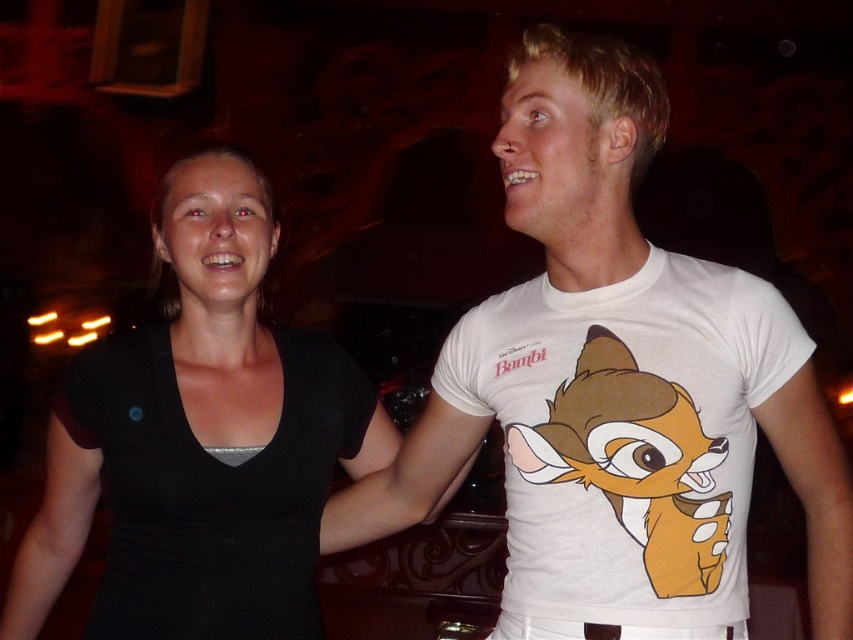
Question: Can you confirm if white cotton t-shirt at upper right is smaller than white cotton t-shirt at right?

Choices:
 (A) no
 (B) yes

Answer: (A)

Question: Considering the relative positions of white cotton t-shirt at upper right and white cotton t-shirt at right in the image provided, where is white cotton t-shirt at upper right located with respect to white cotton t-shirt at right?

Choices:
 (A) right
 (B) left

Answer: (B)

Question: Which object appears closest to the camera in this image?

Choices:
 (A) white cotton t-shirt at right
 (B) white cotton t-shirt at upper right

Answer: (A)

Question: Which object appears farthest from the camera in this image?

Choices:
 (A) white cotton t-shirt at upper right
 (B) black matte dress at left

Answer: (B)

Question: Which point is farther from the camera taking this photo?

Choices:
 (A) (218, 312)
 (B) (595, 592)
 (C) (697, 593)

Answer: (A)

Question: Is white cotton t-shirt at upper right thinner than black matte dress at left?

Choices:
 (A) no
 (B) yes

Answer: (A)